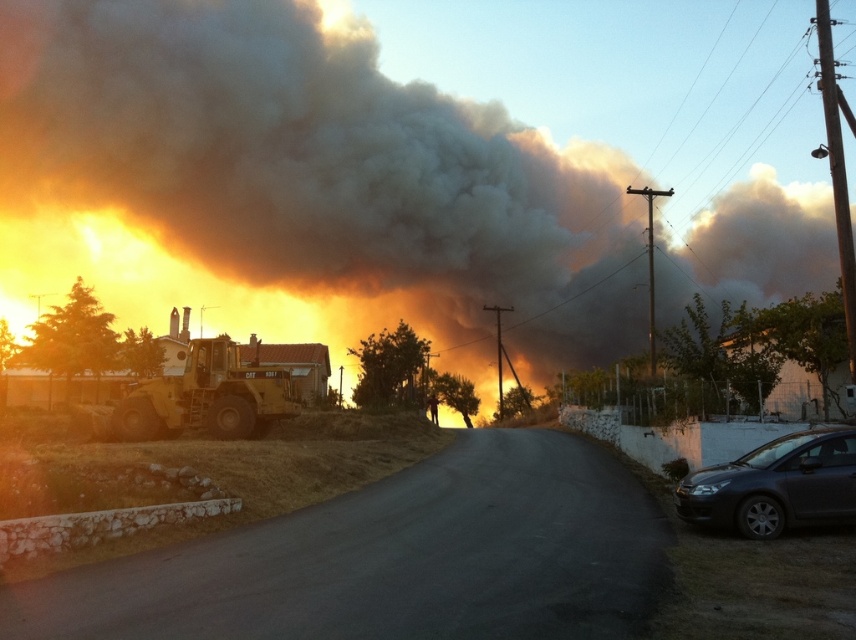
Is black smoke at upper center to the right of dark gray metallic car at lower right from the viewer's perspective?

Incorrect, black smoke at upper center is not on the right side of dark gray metallic car at lower right.

Between black smoke at upper center and dark gray metallic car at lower right, which one has less height?

dark gray metallic car at lower right

This screenshot has height=640, width=856. I want to click on black smoke at upper center, so click(409, 168).